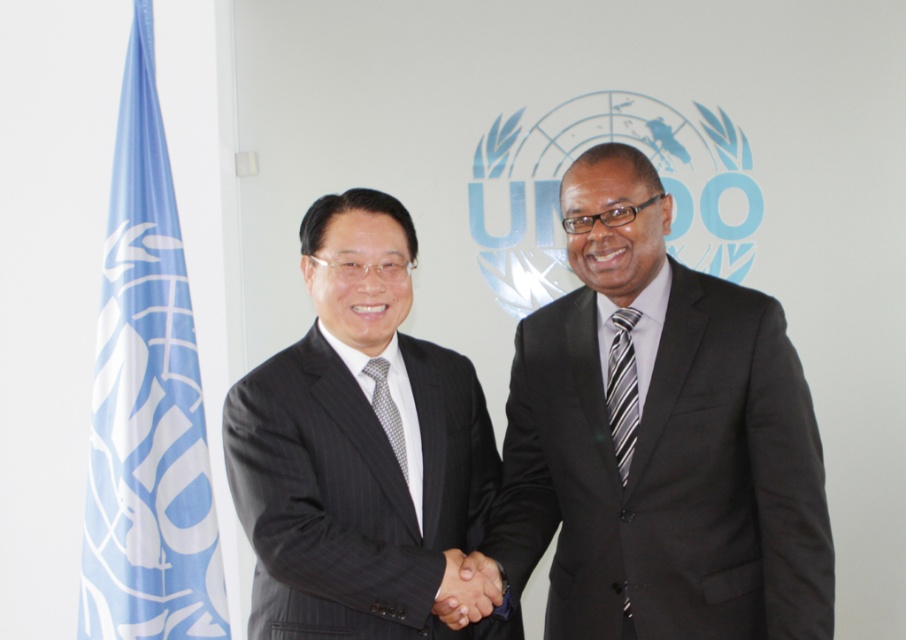
Question: Is the position of blue fabric flag at left more distant than that of striped fabric tie at center?

Choices:
 (A) no
 (B) yes

Answer: (B)

Question: Does blue fabric flag at left come in front of gray dotted tie at center?

Choices:
 (A) no
 (B) yes

Answer: (A)

Question: Which point is closer to the camera?

Choices:
 (A) (386, 381)
 (B) (464, 589)
 (C) (272, 611)
 (D) (729, 330)

Answer: (B)

Question: Is matte black suit at center bigger than black silk hand at center?

Choices:
 (A) yes
 (B) no

Answer: (A)

Question: Which point appears farthest from the camera in this image?

Choices:
 (A) (333, 312)
 (B) (714, 589)
 (C) (392, 436)
 (D) (119, 154)

Answer: (D)

Question: Which point is closer to the camera taking this photo?

Choices:
 (A) coord(307,387)
 (B) coord(632,362)
 (C) coord(382,412)
 (D) coord(153,260)

Answer: (A)